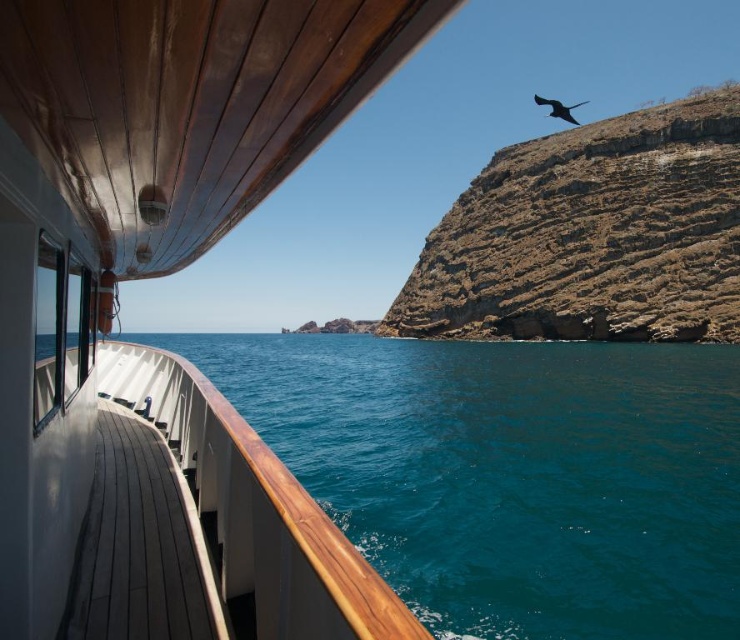
Which is below, wooden deck at left or dark gray glossy bird at upper right?

wooden deck at left is below.

Does wooden deck at left have a greater height compared to dark gray glossy bird at upper right?

Yes, wooden deck at left is taller than dark gray glossy bird at upper right.

Which is behind, point (67, 13) or point (551, 99)?

Positioned behind is point (551, 99).

At what (x,y) coordinates should I click in order to perform the action: click on wooden deck at left. Please return your answer as a coordinate pair (x, y). This screenshot has height=640, width=740. Looking at the image, I should click on (161, 349).

Between teal glossy water at lower left and dark gray glossy bird at upper right, which one appears on the left side from the viewer's perspective?

Positioned to the left is teal glossy water at lower left.

This screenshot has width=740, height=640. What do you see at coordinates (511, 474) in the screenshot?
I see `teal glossy water at lower left` at bounding box center [511, 474].

The image size is (740, 640). Identify the location of teal glossy water at lower left. (511, 474).

Who is more distant from viewer, (403, 36) or (633, 428)?

The point (633, 428) is behind.

At what (x,y) coordinates should I click in order to perform the action: click on wooden deck at left. Please return your answer as a coordinate pair (x, y). Looking at the image, I should click on (161, 349).